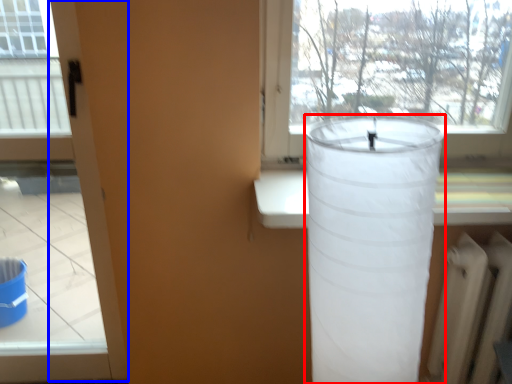
Question: Which point is closer to the camera, lamp (highlighted by a red box) or screen door (highlighted by a blue box)?

Choices:
 (A) lamp
 (B) screen door

Answer: (A)